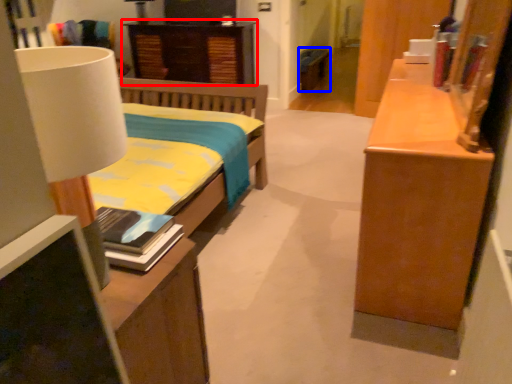
Question: Which point is further to the camera, nightstand (highlighted by a red box) or cabinetry (highlighted by a blue box)?

Choices:
 (A) nightstand
 (B) cabinetry

Answer: (B)